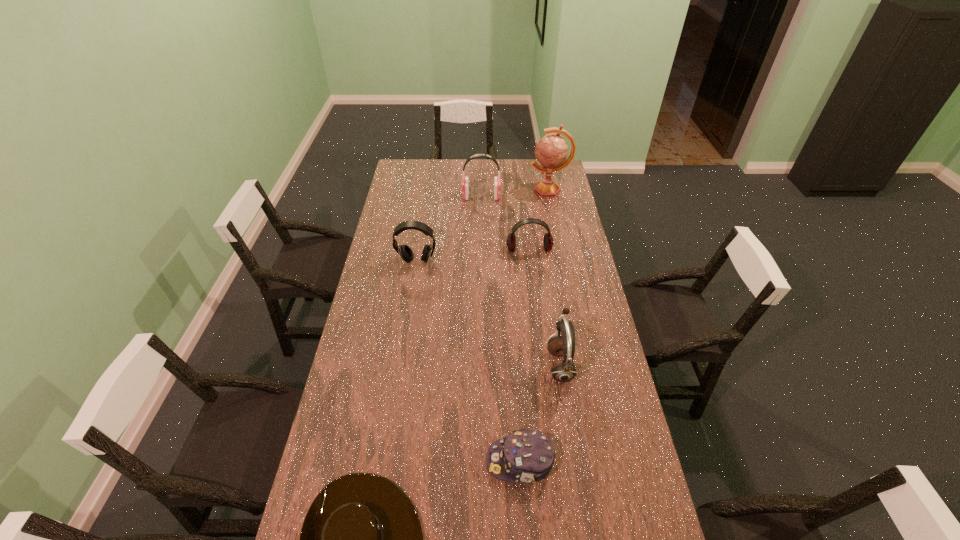
Locate an element on the screen. This screenshot has height=540, width=960. free spot located on the outer surface of the third earphone from right to left is located at coordinates (418, 197).

Locate an element on the screen. Image resolution: width=960 pixels, height=540 pixels. free region located on the outer surface of the third earphone from right to left is located at coordinates (423, 197).

Locate an element on the screen. The height and width of the screenshot is (540, 960). free point located on the ear pads of the fifth farthest object is located at coordinates (451, 364).

At what (x,y) coordinates should I click in order to perform the action: click on vacant area situated on the ear pads of the fifth farthest object. Please return your answer as a coordinate pair (x, y). Looking at the image, I should click on (513, 364).

Locate an element on the screen. vacant space located on the ear pads of the fifth farthest object is located at coordinates (454, 364).

You are a GUI agent. You are given a task and a screenshot of the screen. Output one action in this format:
    pyautogui.click(x=<x>, y=<y>)
    Task: Click on the free spot located on the ear cups of the leftmost earphone
    
    Given the screenshot: What is the action you would take?
    [x=404, y=342]

Locate an element on the screen. vacant space situated on the ear cups of the fifth tallest object is located at coordinates (539, 327).

The height and width of the screenshot is (540, 960). Identify the location of vacant space located 0.120m on the front-facing side of the headwear. (445, 461).

Where is `free space located 0.330m on the front-facing side of the headwear`? free space located 0.330m on the front-facing side of the headwear is located at coordinates (372, 461).

Locate an element on the screen. The image size is (960, 540). free region located 0.310m on the front-facing side of the headwear is located at coordinates (x=379, y=461).